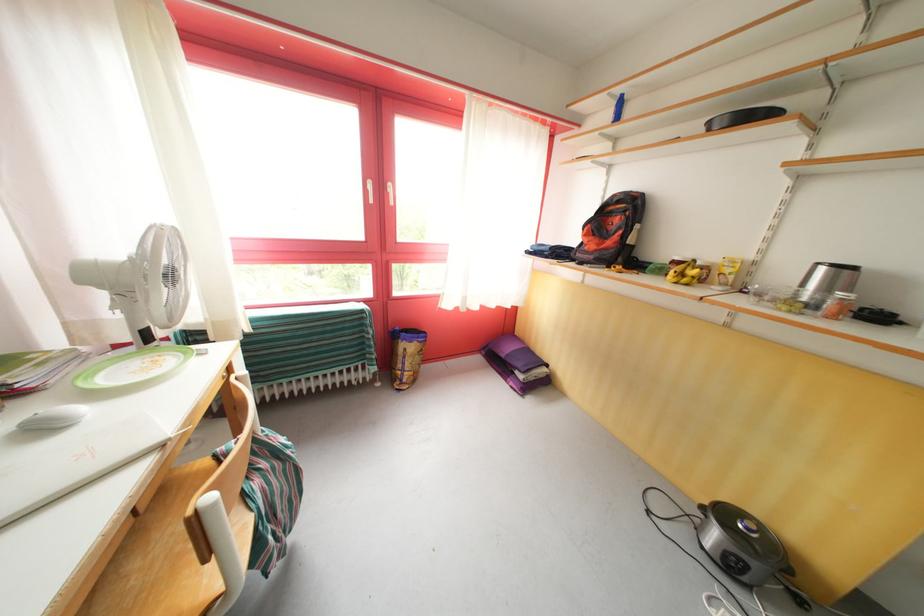
Locate an element on the screen. The width and height of the screenshot is (924, 616). cooker lid handle is located at coordinates (748, 525).